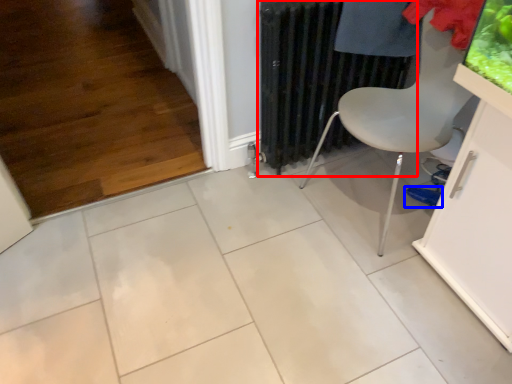
Question: Which object is further to the camera taking this photo, radiator (highlighted by a red box) or footwear (highlighted by a blue box)?

Choices:
 (A) radiator
 (B) footwear

Answer: (B)